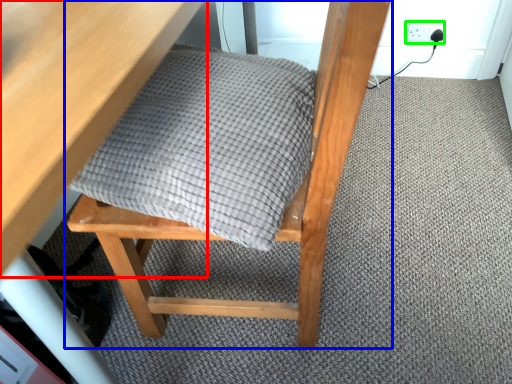
Question: Estimate the real-world distances between objects in this image. Which object is farther from table (highlighted by a red box), chair (highlighted by a blue box) or electric outlet (highlighted by a green box)?

Choices:
 (A) chair
 (B) electric outlet

Answer: (B)